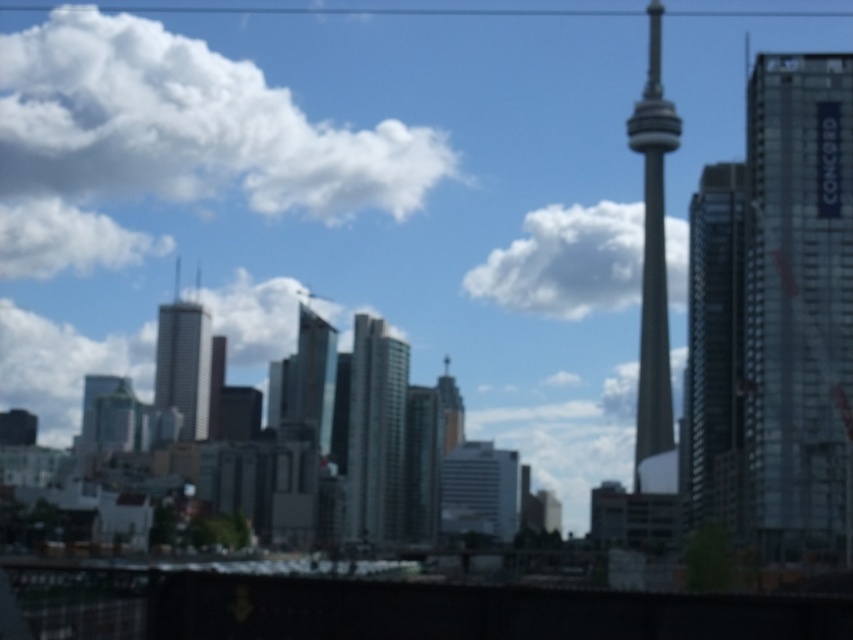
You are a drone operator trying to capture a photo of the cityscape. You have two points marked on your screen, point 1 at coordinates point (86, 189) and point 2 at coordinates point (589, 257). Which point is closer to your camera?

Point (86, 189) is closer to the camera than point (589, 257) because it is further to the camera than the other point.

In the scene shown: Looking at the cityscape, which object is taller between the white fluffy cloud at upper center and the glassy reflective skyscraper at center?

The glassy reflective skyscraper at center is taller than the white fluffy cloud at upper center.